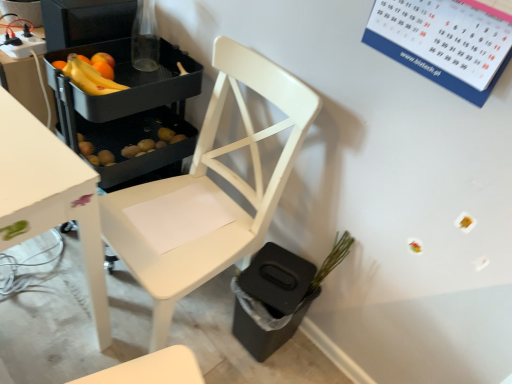
Question: Does white wood chair at center have a smaller size compared to green matte plant at lower right?

Choices:
 (A) yes
 (B) no

Answer: (B)

Question: Is white wood chair at center bigger than green matte plant at lower right?

Choices:
 (A) no
 (B) yes

Answer: (B)

Question: Could you tell me if white wood chair at center is facing green matte plant at lower right?

Choices:
 (A) no
 (B) yes

Answer: (A)

Question: From a real-world perspective, is white wood chair at center located higher than green matte plant at lower right?

Choices:
 (A) no
 (B) yes

Answer: (B)

Question: Can you confirm if white wood chair at center is taller than green matte plant at lower right?

Choices:
 (A) yes
 (B) no

Answer: (A)

Question: Would you say white wood chair at center contains green matte plant at lower right?

Choices:
 (A) no
 (B) yes

Answer: (A)

Question: Is white wood chair at center taller than yellow matte bananas at upper left?

Choices:
 (A) no
 (B) yes

Answer: (B)

Question: Is white wood chair at center at the right side of yellow matte bananas at upper left?

Choices:
 (A) no
 (B) yes

Answer: (B)

Question: Would you say white wood chair at center is a long distance from yellow matte bananas at upper left?

Choices:
 (A) yes
 (B) no

Answer: (B)

Question: Is white wood chair at center to the left of yellow matte bananas at upper left from the viewer's perspective?

Choices:
 (A) no
 (B) yes

Answer: (A)

Question: Would you say white wood chair at center is outside yellow matte bananas at upper left?

Choices:
 (A) yes
 (B) no

Answer: (A)

Question: Is white wood chair at center directly adjacent to yellow matte bananas at upper left?

Choices:
 (A) yes
 (B) no

Answer: (B)

Question: Does matte black tray at upper left appear on the right side of yellow matte bananas at upper left?

Choices:
 (A) yes
 (B) no

Answer: (B)